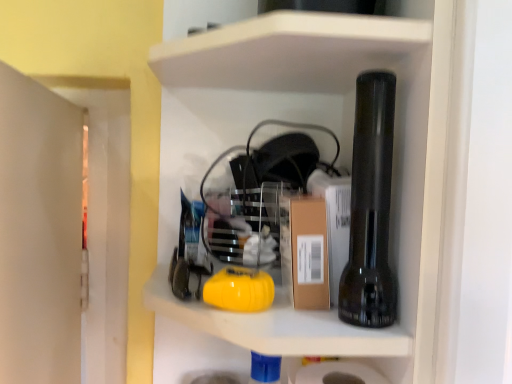
Where is `vacant space that is to the left of black matte beer bottle at right`? vacant space that is to the left of black matte beer bottle at right is located at coordinates (x=265, y=316).